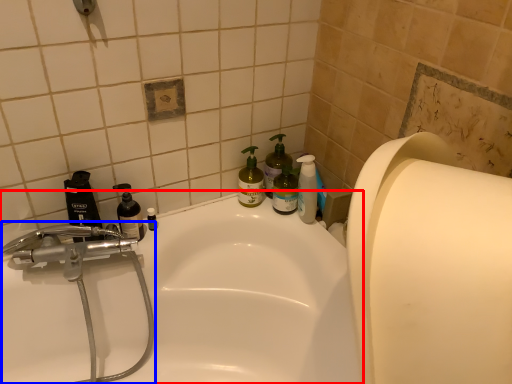
Question: Which point is closer to the camera, bathtub (highlighted by a red box) or plumbing fixture (highlighted by a blue box)?

Choices:
 (A) bathtub
 (B) plumbing fixture

Answer: (A)